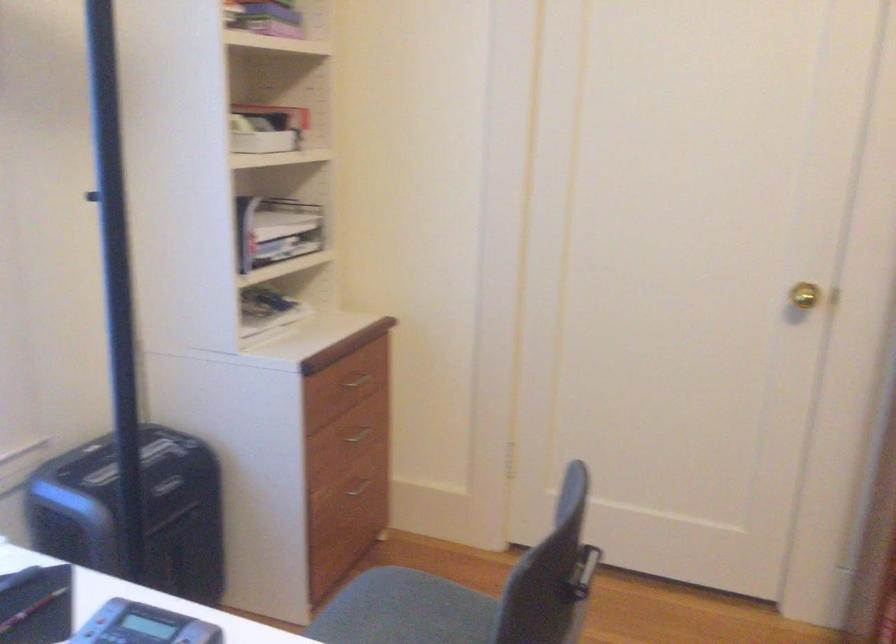
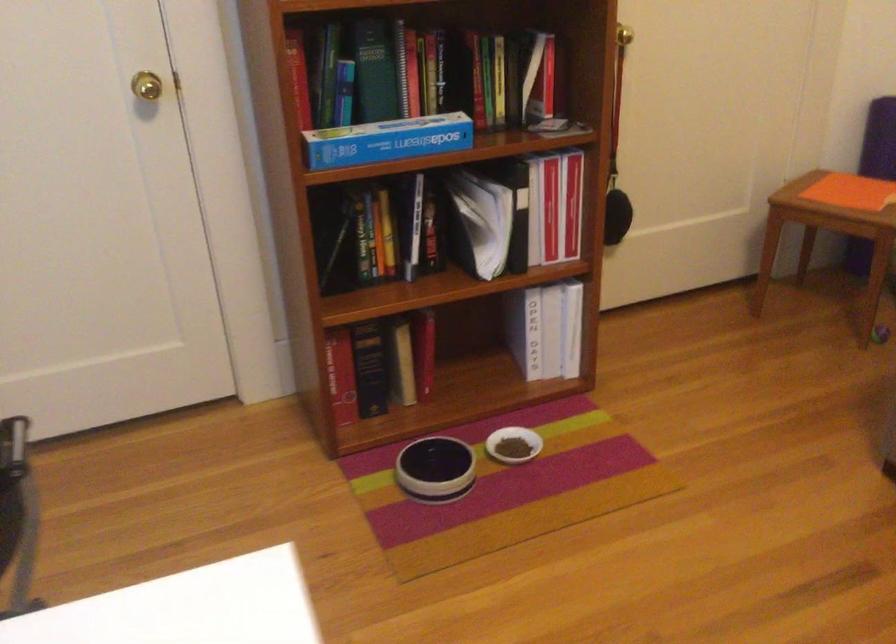
In the second image, find the point that corresponds to [796,296] in the first image.

(147, 86)